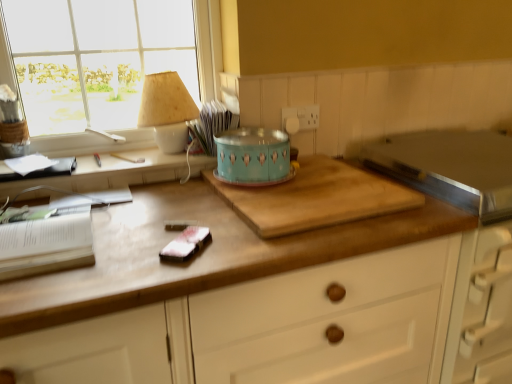
Locate an element on the screen. Image resolution: width=512 pixels, height=384 pixels. vacant point to the left of satin pink fabric at center is located at coordinates (109, 246).